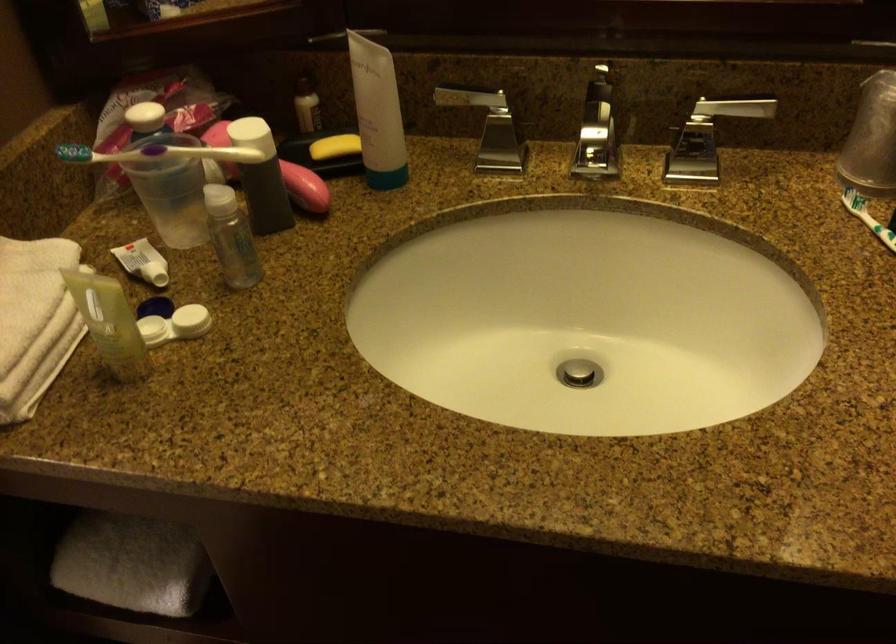
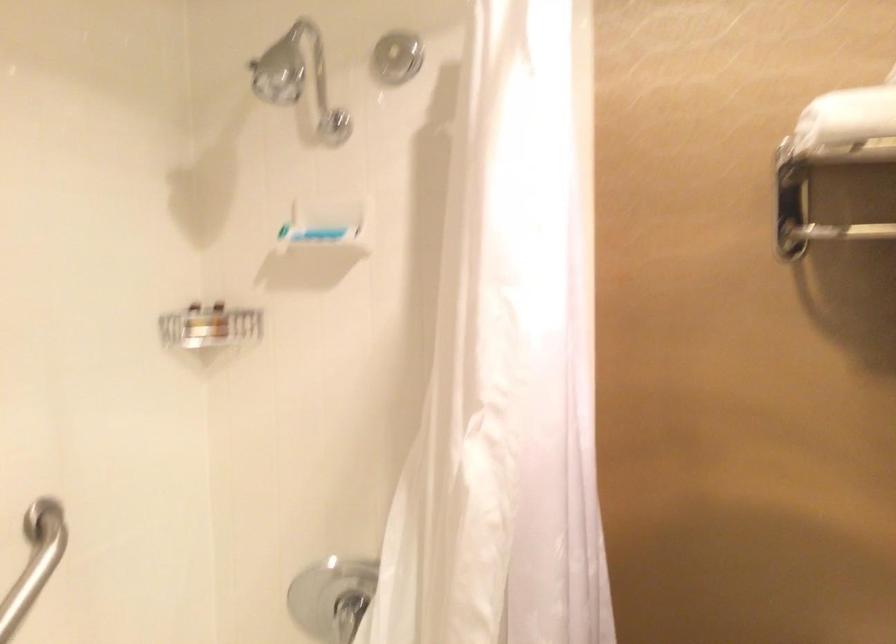
Question: The camera is either moving clockwise (left) or counter-clockwise (right) around the object. The first image is from the beginning of the video and the second image is from the end. Is the camera moving left or right when shooting the video?

Choices:
 (A) Left
 (B) Right

Answer: (B)